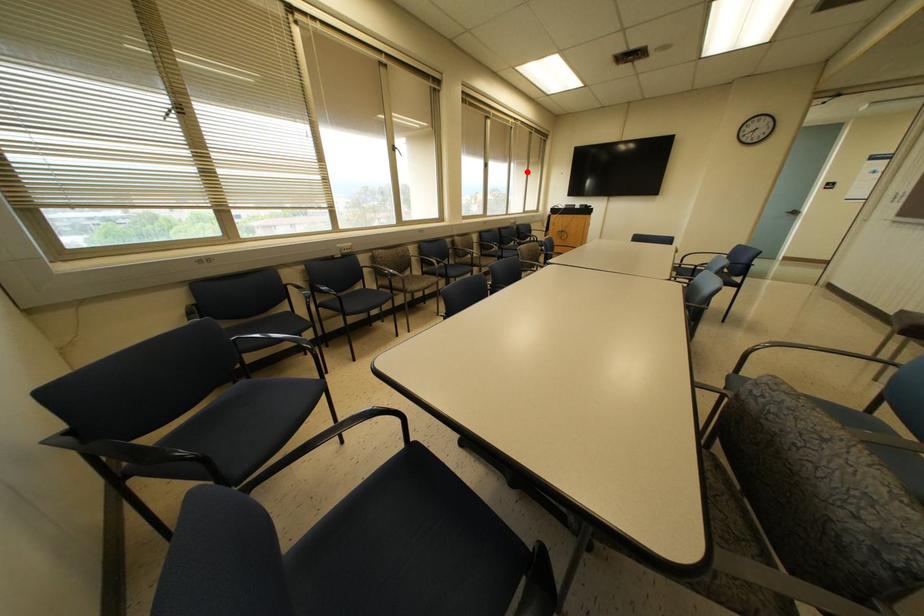
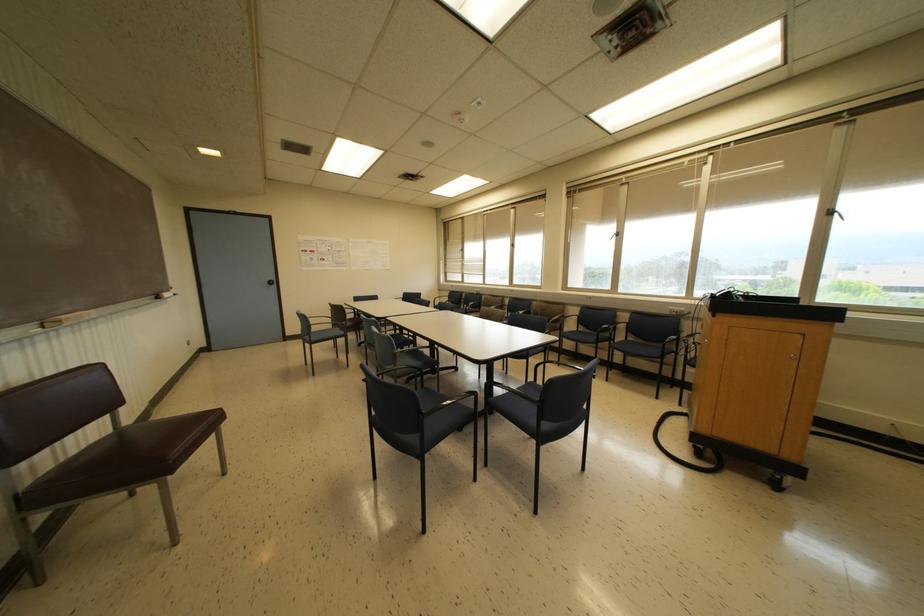
Find the pixel in the second image that matches the highlighted location in the first image.

(827, 213)